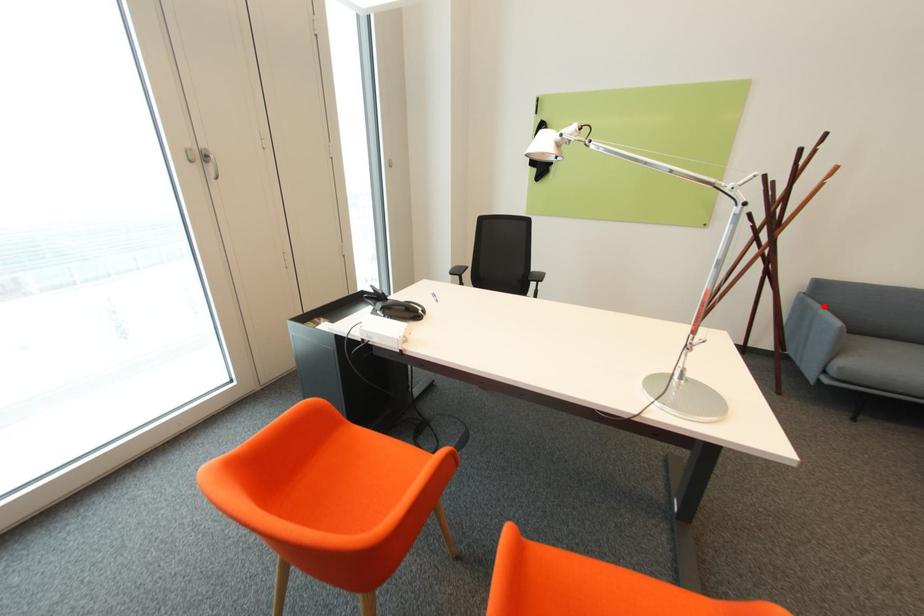
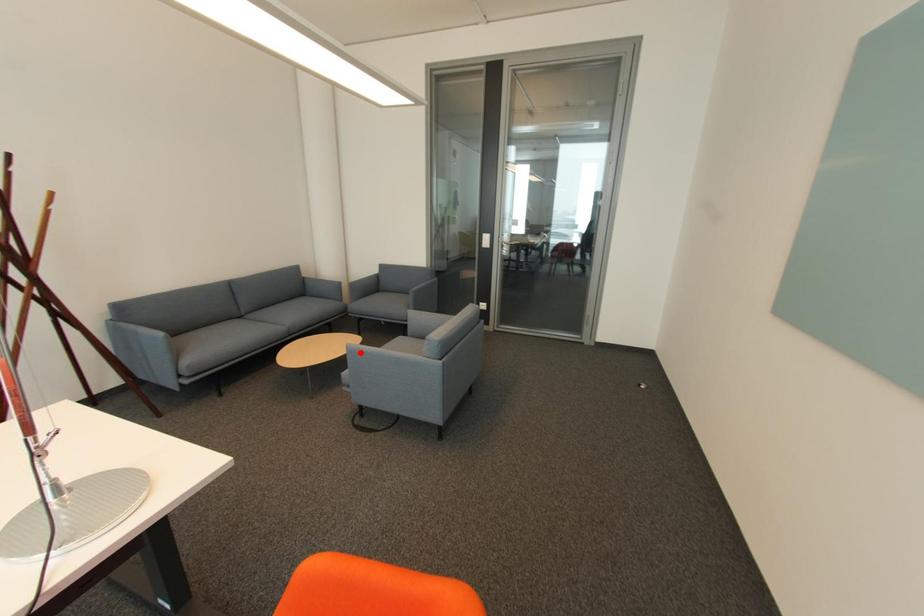
I am providing you with two images of the same scene from different viewpoints. A red point is marked on the first image and another point is marked on the second image. Does the point marked in image1 correspond to the same location as the one in image2?

No